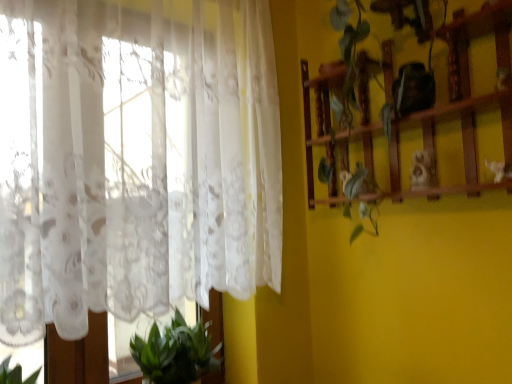
Question: Can you confirm if white lace curtain at left is positioned to the left of green leafy plant at lower left?

Choices:
 (A) yes
 (B) no

Answer: (A)

Question: Does white lace curtain at left appear on the right side of green leafy plant at lower left?

Choices:
 (A) no
 (B) yes

Answer: (A)

Question: Is the position of white lace curtain at left less distant than that of green leafy plant at lower left?

Choices:
 (A) no
 (B) yes

Answer: (B)

Question: Does white lace curtain at left have a greater height compared to green leafy plant at lower left?

Choices:
 (A) yes
 (B) no

Answer: (A)

Question: Would you consider white lace curtain at left to be distant from green leafy plant at lower left?

Choices:
 (A) no
 (B) yes

Answer: (A)

Question: Considering the positions of white lace curtain at left and green leafy plant at lower left in the image, is white lace curtain at left wider or thinner than green leafy plant at lower left?

Choices:
 (A) wide
 (B) thin

Answer: (B)

Question: Is point (91, 173) closer or farther from the camera than point (133, 337)?

Choices:
 (A) closer
 (B) farther

Answer: (A)

Question: From the image's perspective, is white lace curtain at left located above or below green leafy plant at lower left?

Choices:
 (A) above
 (B) below

Answer: (A)

Question: From a real-world perspective, is white lace curtain at left above or below green leafy plant at lower left?

Choices:
 (A) above
 (B) below

Answer: (A)

Question: From a real-world perspective, is green leafy plant at lower left physically located above or below white lace curtain at left?

Choices:
 (A) above
 (B) below

Answer: (B)

Question: Is green leafy plant at lower left bigger or smaller than white lace curtain at left?

Choices:
 (A) small
 (B) big

Answer: (A)

Question: In terms of width, does green leafy plant at lower left look wider or thinner when compared to white lace curtain at left?

Choices:
 (A) thin
 (B) wide

Answer: (B)

Question: Is point (189, 354) positioned closer to the camera than point (38, 193)?

Choices:
 (A) farther
 (B) closer

Answer: (A)

Question: Choose the correct answer: Is wooden shelf at right inside white lace curtain at left or outside it?

Choices:
 (A) inside
 (B) outside

Answer: (B)

Question: Looking at their shapes, would you say wooden shelf at right is wider or thinner than white lace curtain at left?

Choices:
 (A) wide
 (B) thin

Answer: (B)